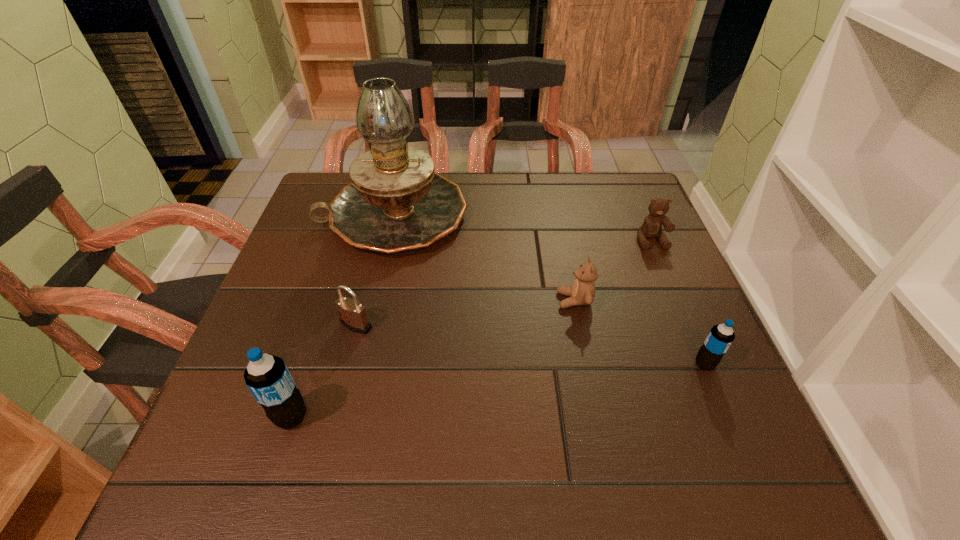
Identify the location of the fifth closest object to the oil lamp. This screenshot has height=540, width=960. (721, 336).

Image resolution: width=960 pixels, height=540 pixels. In order to click on the fourth closest object to the farther teddy bear in this screenshot , I will do `click(353, 316)`.

Where is `free space that satisfies the following two spatial constraints: 1. on the back side of the nearer soda bottle; 2. on the right side of the oil lamp`? free space that satisfies the following two spatial constraints: 1. on the back side of the nearer soda bottle; 2. on the right side of the oil lamp is located at coordinates (357, 215).

The height and width of the screenshot is (540, 960). What are the coordinates of `free space that satisfies the following two spatial constraints: 1. on the front-facing side of the shorter soda bottle; 2. on the right side of the left teddy bear` in the screenshot? It's located at (588, 364).

Where is `free space that satisfies the following two spatial constraints: 1. on the front side of the padlock; 2. on the left side of the farther soda bottle`? This screenshot has height=540, width=960. free space that satisfies the following two spatial constraints: 1. on the front side of the padlock; 2. on the left side of the farther soda bottle is located at coordinates (346, 364).

You are a GUI agent. You are given a task and a screenshot of the screen. Output one action in this format:
    pyautogui.click(x=<x>, y=<y>)
    Task: Click on the vacant area in the image that satisfies the following two spatial constraints: 1. on the face of the shorter soda bottle; 2. on the left side of the farther teddy bear
    The height and width of the screenshot is (540, 960).
    Given the screenshot: What is the action you would take?
    pyautogui.click(x=704, y=364)